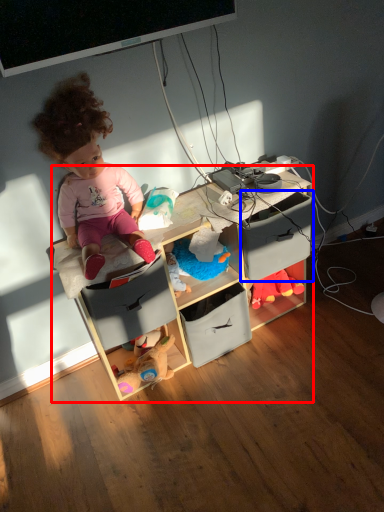
Question: Which of the following is the closest to the observer, shelf (highlighted by a red box) or drawer (highlighted by a blue box)?

Choices:
 (A) shelf
 (B) drawer

Answer: (A)